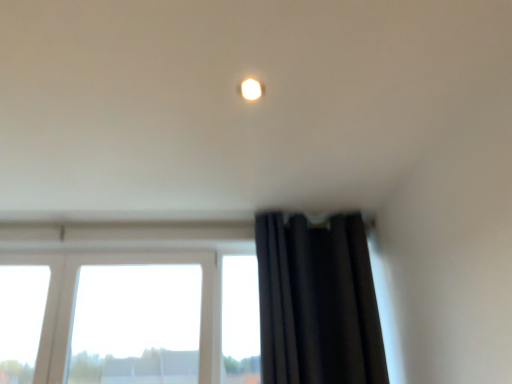
What do you see at coordinates (251, 89) in the screenshot? I see `matte white light fixture at upper center` at bounding box center [251, 89].

What is the approximate width of matte white light fixture at upper center?

4.01 inches.

Measure the distance between matte white light fixture at upper center and camera.

A distance of 4.06 feet exists between matte white light fixture at upper center and camera.

The width and height of the screenshot is (512, 384). I want to click on matte white light fixture at upper center, so click(x=251, y=89).

Where is `black velvet curtain at right`? The image size is (512, 384). black velvet curtain at right is located at coordinates (317, 302).

The height and width of the screenshot is (384, 512). What do you see at coordinates (317, 302) in the screenshot? I see `black velvet curtain at right` at bounding box center [317, 302].

The height and width of the screenshot is (384, 512). I want to click on matte white light fixture at upper center, so click(x=251, y=89).

Does matte white light fixture at upper center appear on the right side of black velvet curtain at right?

In fact, matte white light fixture at upper center is to the left of black velvet curtain at right.

Which is behind, matte white light fixture at upper center or black velvet curtain at right?

black velvet curtain at right.

Is point (245, 98) farther from camera compared to point (345, 344)?

No, it is in front of (345, 344).

From the image's perspective, is matte white light fixture at upper center positioned above or below black velvet curtain at right?

Based on their image positions, matte white light fixture at upper center is located above black velvet curtain at right.

From a real-world perspective, is matte white light fixture at upper center physically located above or below black velvet curtain at right?

Clearly, from a real-world perspective, matte white light fixture at upper center is above black velvet curtain at right.

Considering the sizes of matte white light fixture at upper center and black velvet curtain at right in the image, is matte white light fixture at upper center wider or thinner than black velvet curtain at right?

Clearly, matte white light fixture at upper center has less width compared to black velvet curtain at right.

Does matte white light fixture at upper center have a greater height compared to black velvet curtain at right?

No.

Is matte white light fixture at upper center bigger or smaller than black velvet curtain at right?

matte white light fixture at upper center is smaller than black velvet curtain at right.

Would you say black velvet curtain at right is part of matte white light fixture at upper center's contents?

No, matte white light fixture at upper center does not contain black velvet curtain at right.

Is matte white light fixture at upper center directly adjacent to black velvet curtain at right?

No, matte white light fixture at upper center is not in contact with black velvet curtain at right.

Is matte white light fixture at upper center oriented towards black velvet curtain at right?

No, matte white light fixture at upper center is not aimed at black velvet curtain at right.

What's the angular difference between matte white light fixture at upper center and black velvet curtain at right's facing directions?

The angle between the facing direction of matte white light fixture at upper center and the facing direction of black velvet curtain at right is 2.83 degrees.

Locate an element on the screen. This screenshot has height=384, width=512. curtain that appears below the matte white light fixture at upper center (from a real-world perspective) is located at coordinates (317, 302).

Which is more to the right, black velvet curtain at right or matte white light fixture at upper center?

black velvet curtain at right is more to the right.

Which object is further away from the camera, black velvet curtain at right or matte white light fixture at upper center?

black velvet curtain at right is further from the camera.

Is point (359, 306) closer to camera compared to point (241, 84)?

No, it is behind (241, 84).

From the image's perspective, relative to matte white light fixture at upper center, is black velvet curtain at right above or below?

From the image's perspective, black velvet curtain at right appears below matte white light fixture at upper center.

From a real-world perspective, which object stands above the other?

From a 3D spatial view, matte white light fixture at upper center is above.

Does black velvet curtain at right have a lesser width compared to matte white light fixture at upper center?

No.

Is black velvet curtain at right shorter than matte white light fixture at upper center?

In fact, black velvet curtain at right may be taller than matte white light fixture at upper center.

Is black velvet curtain at right smaller than matte white light fixture at upper center?

Actually, black velvet curtain at right might be larger than matte white light fixture at upper center.

Is black velvet curtain at right surrounding matte white light fixture at upper center?

No, black velvet curtain at right does not contain matte white light fixture at upper center.

Is black velvet curtain at right far from matte white light fixture at upper center?

Absolutely, black velvet curtain at right is distant from matte white light fixture at upper center.

Is black velvet curtain at right facing towards matte white light fixture at upper center?

Yes, black velvet curtain at right is turned towards matte white light fixture at upper center.

How different are the orientations of black velvet curtain at right and matte white light fixture at upper center in degrees?

The angular difference between black velvet curtain at right and matte white light fixture at upper center is 2.83 degrees.

How distant is black velvet curtain at right from matte white light fixture at upper center?

black velvet curtain at right and matte white light fixture at upper center are 3.70 feet apart from each other.

The image size is (512, 384). Find the location of `lighting in front of the black velvet curtain at right`. lighting in front of the black velvet curtain at right is located at coordinates (251, 89).

Find the location of a particular element. lighting in front of the black velvet curtain at right is located at coordinates (251, 89).

This screenshot has height=384, width=512. Find the location of `lighting that is above the black velvet curtain at right (from a real-world perspective)`. lighting that is above the black velvet curtain at right (from a real-world perspective) is located at coordinates (251, 89).